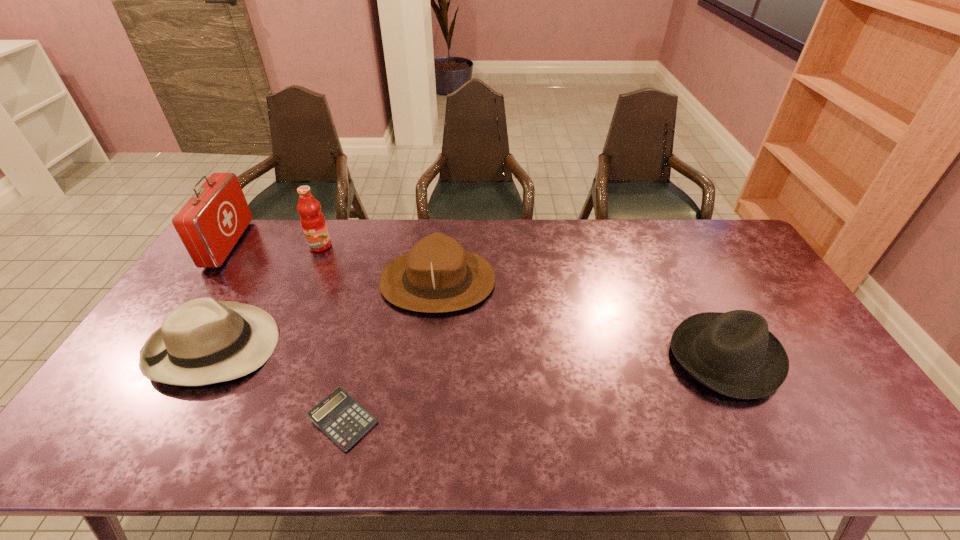
The image size is (960, 540). What are the coordinates of `empty space that is in between the leftmost fedora and the fruit juice` in the screenshot? It's located at (267, 296).

I want to click on empty space that is in between the second fedora from right to left and the leftmost fedora, so click(325, 314).

Locate an element on the screen. This screenshot has height=540, width=960. vacant space that is in between the leftmost fedora and the rightmost fedora is located at coordinates point(469,352).

The height and width of the screenshot is (540, 960). I want to click on unoccupied area between the fruit juice and the calculator, so click(x=332, y=333).

This screenshot has width=960, height=540. What are the coordinates of `free spot between the fruit juice and the third tallest object` in the screenshot? It's located at (379, 264).

This screenshot has height=540, width=960. Find the location of `the fifth closest object to the calculator`. the fifth closest object to the calculator is located at coordinates (734, 353).

Point out which object is positioned as the fifth nearest to the leftmost fedora. Please provide its 2D coordinates. Your answer should be formatted as a tuple, i.e. [(x, y)], where the tuple contains the x and y coordinates of a point satisfying the conditions above.

[(734, 353)]

You are a GUI agent. You are given a task and a screenshot of the screen. Output one action in this format:
    pyautogui.click(x=<x>, y=<y>)
    Task: Click on the closest fedora relative to the third tallest object
    The height and width of the screenshot is (540, 960).
    Given the screenshot: What is the action you would take?
    pyautogui.click(x=202, y=342)

Image resolution: width=960 pixels, height=540 pixels. I want to click on fedora object that ranks as the closest to the first-aid kit, so click(202, 342).

This screenshot has height=540, width=960. Find the location of `vacant space that satisfies the following two spatial constraints: 1. on the front-facing side of the leftmost fedora; 2. on the back side of the rightmost object`. vacant space that satisfies the following two spatial constraints: 1. on the front-facing side of the leftmost fedora; 2. on the back side of the rightmost object is located at coordinates (209, 356).